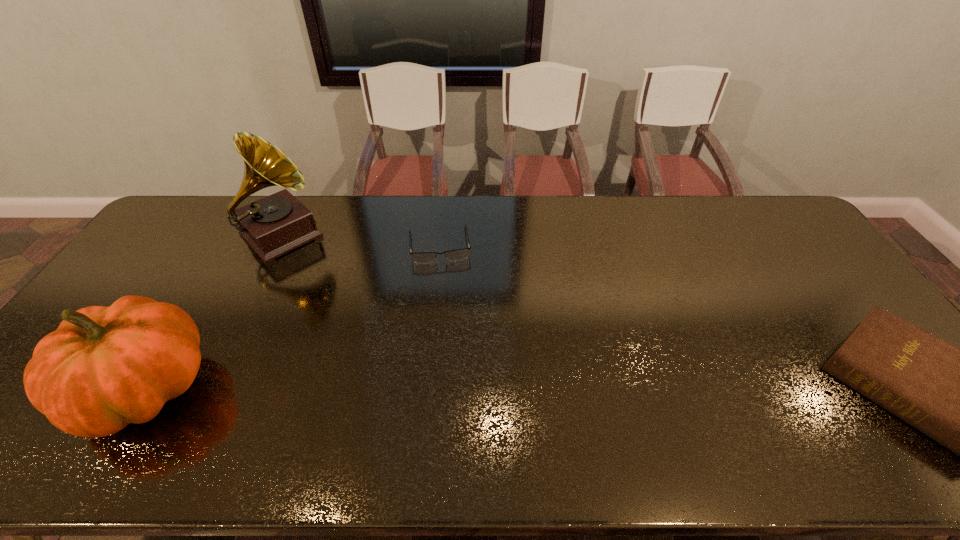
In order to click on vacant spot on the desktop that is between the pumpkin and the rightmost object and is positioned on the front-facing side of the third object from left to right in this screenshot , I will do coord(455,388).

At what (x,y) coordinates should I click in order to perform the action: click on free spot on the desktop that is between the pumpkin and the rightmost object and is positioned from the horn of the tallest object. Please return your answer as a coordinate pair (x, y). The width and height of the screenshot is (960, 540). Looking at the image, I should click on pyautogui.click(x=432, y=388).